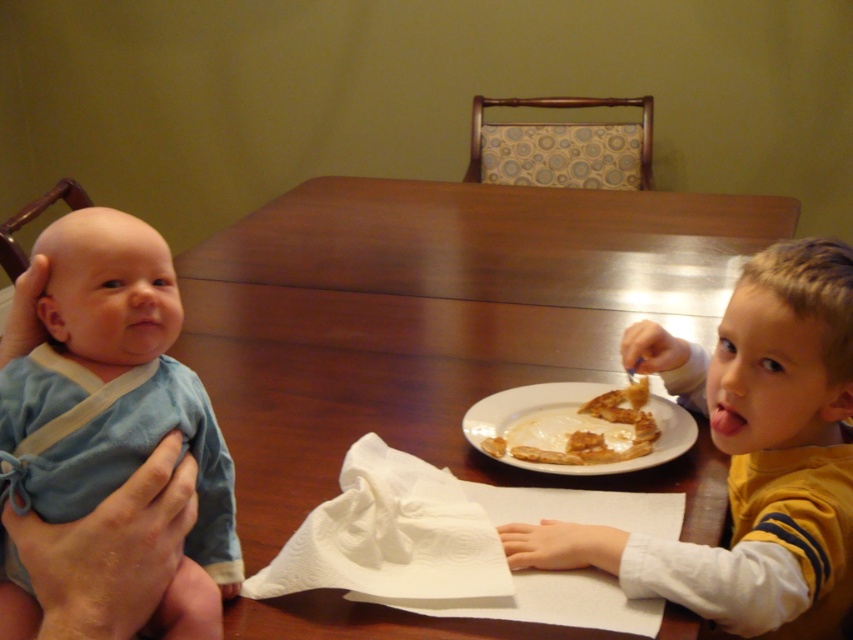
Question: Among these objects, which one is farthest from the camera?

Choices:
 (A) golden brown crispy pastry at center
 (B) yellow striped shirt at right

Answer: (A)

Question: Which object is farther from the camera taking this photo?

Choices:
 (A) golden brown crispy pastry at center
 (B) blue cotton baby at left
 (C) yellow striped shirt at right

Answer: (A)

Question: Can you confirm if yellow striped shirt at right is positioned to the left of golden brown crispy pastry at center?

Choices:
 (A) yes
 (B) no

Answer: (B)

Question: Is yellow striped shirt at right below golden brown crispy pastry at center?

Choices:
 (A) yes
 (B) no

Answer: (A)

Question: Is yellow striped shirt at right positioned before golden brown crispy pastry at center?

Choices:
 (A) no
 (B) yes

Answer: (B)

Question: Which object is the closest to the yellow striped shirt at right?

Choices:
 (A) golden brown crispy pastry at center
 (B) blue cotton baby at left

Answer: (A)